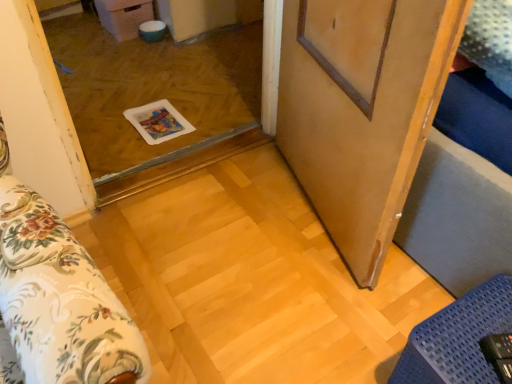
The height and width of the screenshot is (384, 512). What do you see at coordinates (154, 88) in the screenshot?
I see `transparent plastic tray at center` at bounding box center [154, 88].

Find the location of a particular element. transparent plastic tray at center is located at coordinates (154, 88).

Locate an element on the screen. The image size is (512, 384). transparent plastic tray at center is located at coordinates (154, 88).

Can you see blue textured mat at lower right touching wooden barn door at center?

There is a gap between blue textured mat at lower right and wooden barn door at center.

In the scene shown: Is the depth of blue textured mat at lower right less than that of wooden barn door at center?

No, blue textured mat at lower right is further to the viewer.

From the image's perspective, which one is positioned lower, blue textured mat at lower right or wooden barn door at center?

blue textured mat at lower right, from the image's perspective.

Is blue textured mat at lower right looking in the opposite direction of wooden barn door at center?

blue textured mat at lower right does not have its back to wooden barn door at center.

From the image's perspective, is blue textured mat at lower right located above transparent plastic tray at center?

Incorrect, from the image's perspective, blue textured mat at lower right is lower than transparent plastic tray at center.

Can you tell me how much blue textured mat at lower right and transparent plastic tray at center differ in facing direction?

90.4 degrees separate the facing orientations of blue textured mat at lower right and transparent plastic tray at center.

Is transparent plastic tray at center inside blue textured mat at lower right?

No, blue textured mat at lower right does not contain transparent plastic tray at center.

Does point (436, 339) appear closer or farther from the camera than point (217, 39)?

Clearly, point (436, 339) is closer to the camera than point (217, 39).

Where is `barn door that is on the left side of blue textured mat at lower right`? barn door that is on the left side of blue textured mat at lower right is located at coordinates (362, 111).

From the picture: Which object is positioned more to the left, wooden barn door at center or blue textured mat at lower right?

wooden barn door at center.

Considering the points (289, 14) and (499, 350), which point is in front, point (289, 14) or point (499, 350)?

The point (499, 350) is in front.

Can you tell me how much wooden barn door at center and blue textured mat at lower right differ in facing direction?

The angular difference between wooden barn door at center and blue textured mat at lower right is 12.2 degrees.

Does wooden barn door at center contain transparent plastic tray at center?

That's incorrect, transparent plastic tray at center is not inside wooden barn door at center.

Is wooden barn door at center in front of or behind transparent plastic tray at center in the image?

Clearly, wooden barn door at center is in front of transparent plastic tray at center.

Is wooden barn door at center turned away from transparent plastic tray at center?

No, transparent plastic tray at center is not at the back of wooden barn door at center.

Looking at this image, from a real-world perspective, is wooden barn door at center physically above transparent plastic tray at center?

Correct, in the physical world, wooden barn door at center is higher than transparent plastic tray at center.

From the image's perspective, which is below, transparent plastic tray at center or wooden barn door at center?

wooden barn door at center, from the image's perspective.

Consider the image. Is transparent plastic tray at center spatially inside wooden barn door at center, or outside of it?

transparent plastic tray at center is outside wooden barn door at center.

Considering the positions of point (112, 48) and point (294, 26), is point (112, 48) closer or farther from the camera than point (294, 26)?

Point (112, 48) is positioned farther from the camera compared to point (294, 26).

Is transparent plastic tray at center turned away from blue textured mat at lower right?

No, transparent plastic tray at center's orientation is not away from blue textured mat at lower right.

Which of these two, transparent plastic tray at center or blue textured mat at lower right, stands shorter?

transparent plastic tray at center is shorter.

Is transparent plastic tray at center not near blue textured mat at lower right?

Yes.

From the image's perspective, would you say transparent plastic tray at center is positioned over blue textured mat at lower right?

Correct, transparent plastic tray at center appears higher than blue textured mat at lower right in the image.

This screenshot has height=384, width=512. Find the location of `barn door on the left of blue textured mat at lower right`. barn door on the left of blue textured mat at lower right is located at coordinates (362, 111).

Locate an element on the screen. Image resolution: width=512 pixels, height=384 pixels. furniture that appears below the transparent plastic tray at center (from the image's perspective) is located at coordinates (463, 340).

Which object lies nearer to the anchor point wooden barn door at center, blue textured mat at lower right or transparent plastic tray at center?

blue textured mat at lower right lies closer to wooden barn door at center than the other object.

Which object lies nearer to the anchor point transparent plastic tray at center, wooden barn door at center or blue textured mat at lower right?

wooden barn door at center is positioned closer to the anchor transparent plastic tray at center.

When comparing their distances from wooden barn door at center, does transparent plastic tray at center or blue textured mat at lower right seem further?

transparent plastic tray at center lies further to wooden barn door at center than the other object.

Considering their positions, is transparent plastic tray at center positioned further to blue textured mat at lower right than wooden barn door at center?

transparent plastic tray at center lies further to blue textured mat at lower right than the other object.

When comparing their distances from blue textured mat at lower right, does wooden barn door at center or transparent plastic tray at center seem closer?

wooden barn door at center is positioned closer to the anchor blue textured mat at lower right.

Estimate the real-world distances between objects in this image. Which object is further from transparent plastic tray at center, blue textured mat at lower right or wooden barn door at center?

Among the two, blue textured mat at lower right is located further to transparent plastic tray at center.

The image size is (512, 384). I want to click on barn door located between transparent plastic tray at center and blue textured mat at lower right in the left-right direction, so click(362, 111).